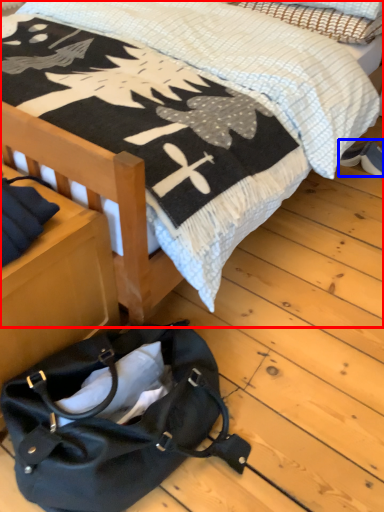
Question: Among these objects, which one is farthest to the camera, bed (highlighted by a red box) or footwear (highlighted by a blue box)?

Choices:
 (A) bed
 (B) footwear

Answer: (B)